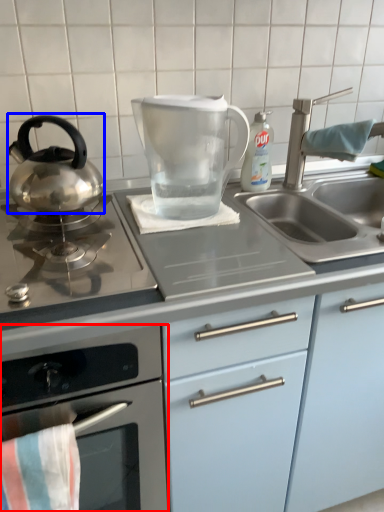
Question: Among these objects, which one is farthest to the camera, kitchen appliance (highlighted by a red box) or kitchen appliance (highlighted by a blue box)?

Choices:
 (A) kitchen appliance
 (B) kitchen appliance

Answer: (B)